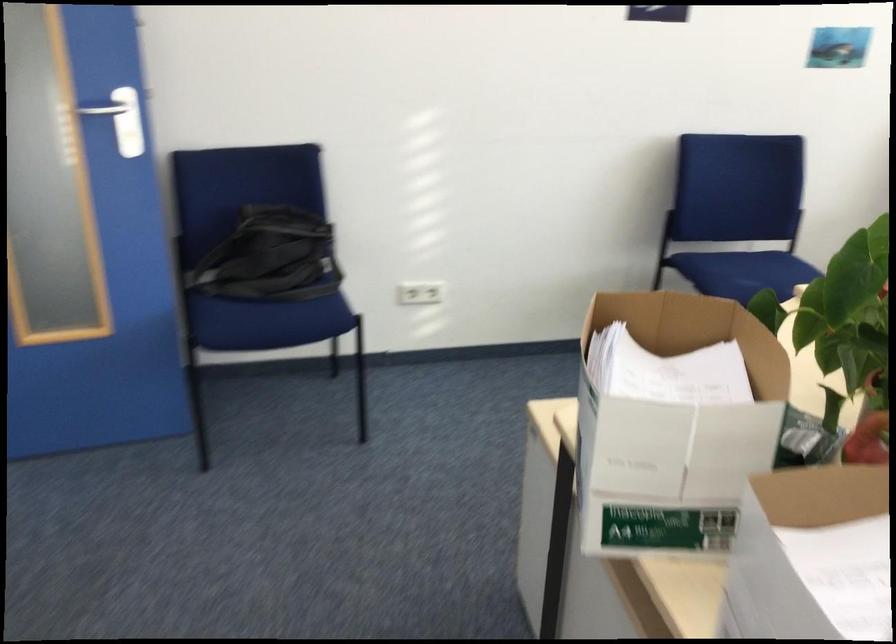
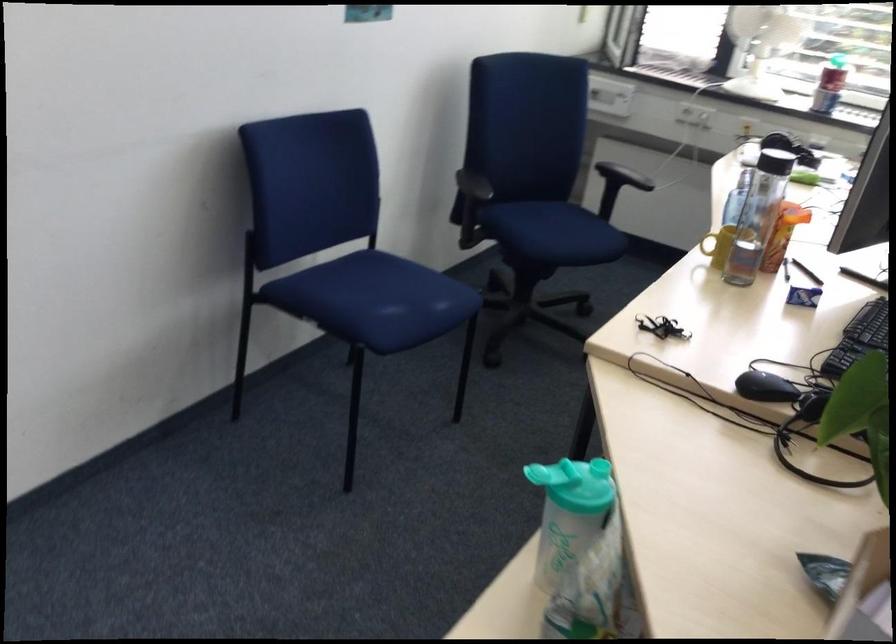
Locate, in the second image, the point that corresponds to point (746, 265) in the first image.

(374, 299)